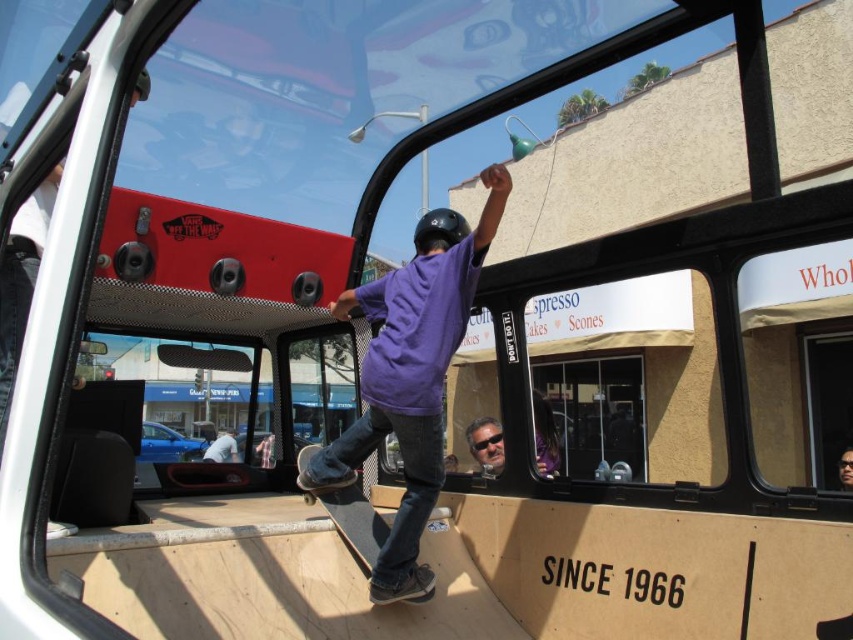
Question: Does purple matte skateboard at center appear on the right side of wooden skateboard at center?

Choices:
 (A) yes
 (B) no

Answer: (A)

Question: Considering the real-world distances, which object is farthest from the light blue jeans at lower center?

Choices:
 (A) wooden skateboard at center
 (B) purple matte skateboard at center
 (C) gray textured hair at center

Answer: (B)

Question: Which point appears farthest from the camera in this image?

Choices:
 (A) (427, 387)
 (B) (503, 452)
 (C) (228, 428)
 (D) (355, 547)

Answer: (C)

Question: Does purple matte skateboard at center appear on the left side of gray textured hair at center?

Choices:
 (A) yes
 (B) no

Answer: (A)

Question: Is purple matte skateboard at center wider than light blue jeans at lower center?

Choices:
 (A) yes
 (B) no

Answer: (A)

Question: Which object is the closest to the light blue jeans at lower center?

Choices:
 (A) purple matte skateboard at center
 (B) gray textured hair at center
 (C) wooden skateboard at center

Answer: (B)